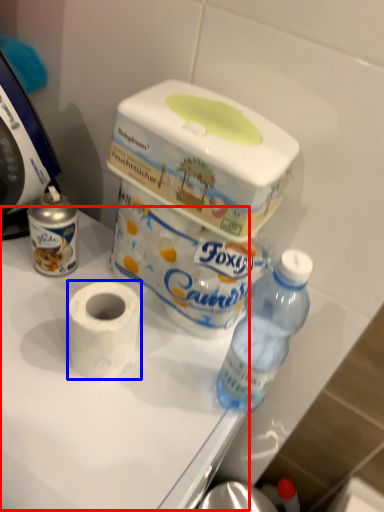
Question: Which object is closer to the camera taking this photo, table (highlighted by a red box) or toilet paper (highlighted by a blue box)?

Choices:
 (A) table
 (B) toilet paper

Answer: (A)